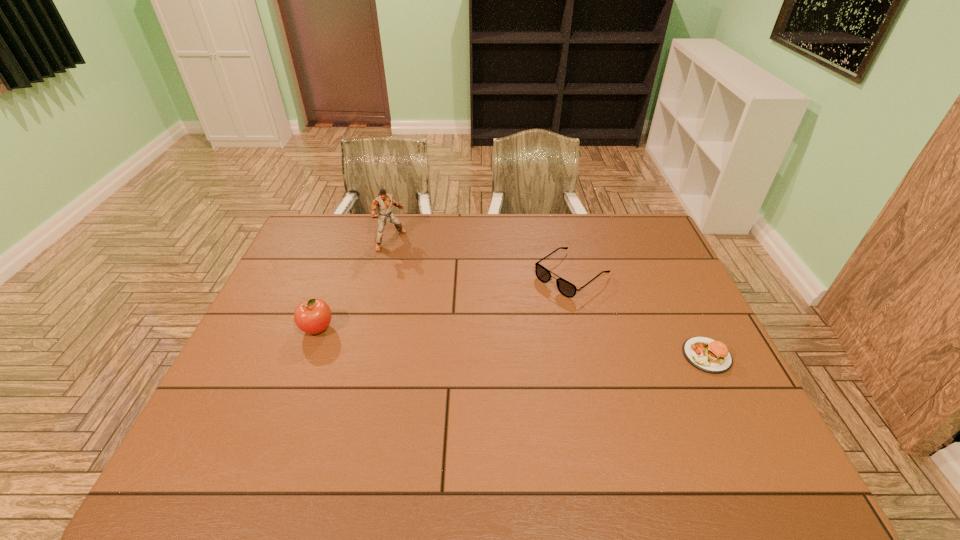
Locate an element on the screen. This screenshot has width=960, height=540. apple is located at coordinates (313, 316).

You are a GUI agent. You are given a task and a screenshot of the screen. Output one action in this format:
    pyautogui.click(x=<x>, y=<y>)
    Task: Click on the third shortest object
    
    Given the screenshot: What is the action you would take?
    pyautogui.click(x=313, y=316)

The width and height of the screenshot is (960, 540). What are the coordinates of `patty` in the screenshot? It's located at (711, 356).

Locate an element on the screen. The height and width of the screenshot is (540, 960). the shortest object is located at coordinates (711, 356).

At what (x,y) coordinates should I click in order to perform the action: click on the third object from left to right. Please return your answer as a coordinate pair (x, y). Looking at the image, I should click on (566, 288).

The height and width of the screenshot is (540, 960). Find the location of `the third tallest object`. the third tallest object is located at coordinates point(566,288).

You are a GUI agent. You are given a task and a screenshot of the screen. Output one action in this format:
    pyautogui.click(x=<x>, y=<y>)
    Task: Click on the puncher
    
    Given the screenshot: What is the action you would take?
    pyautogui.click(x=383, y=202)

At what (x,y) coordinates should I click in order to perform the action: click on the tallest object. Please return your answer as a coordinate pair (x, y). This screenshot has height=540, width=960. Looking at the image, I should click on (383, 202).

Locate an element on the screen. free space located on the back of the leftmost object is located at coordinates (340, 268).

At what (x,y) coordinates should I click in order to perform the action: click on free spot located 0.300m on the back of the patty. Please return your answer as a coordinate pair (x, y). This screenshot has width=960, height=540. Looking at the image, I should click on (664, 269).